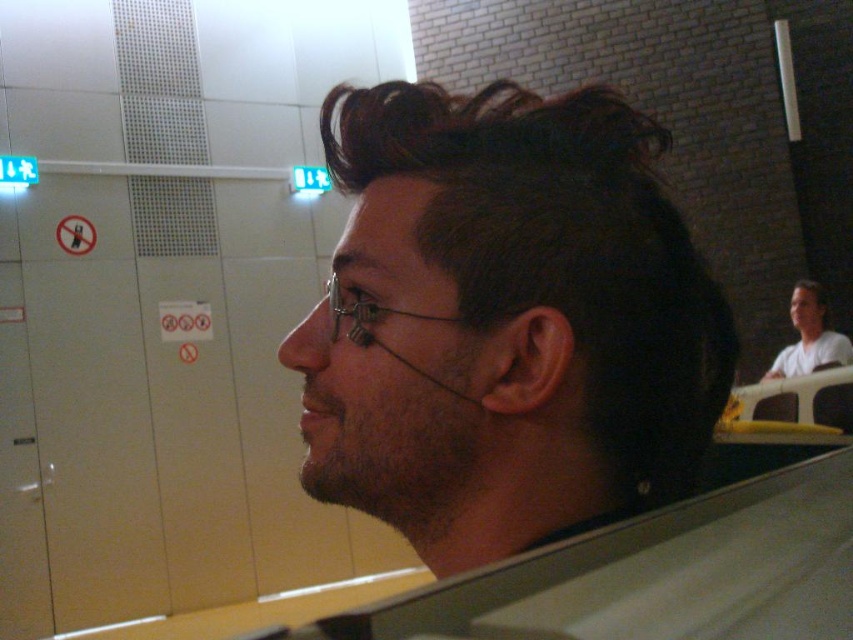
You are an observer looking at the man in the scene. Which object, the white matte shirt at upper right or the clear plastic glasses at center, is closer to you?

The white matte shirt at upper right is closer to you because it is further to the viewer than the clear plastic glasses at center.

What is the color and texture of the object located at point coordinates (x=809, y=337)?

The object at point coordinates (x=809, y=337) is a white matte shirt at upper right.